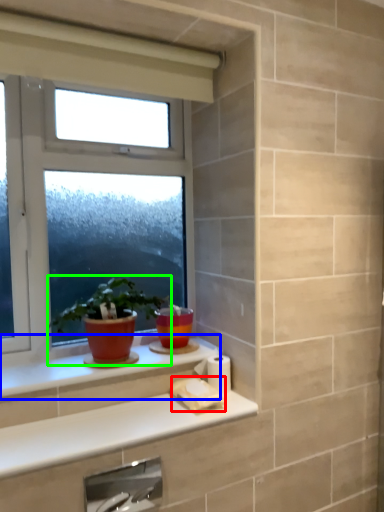
Question: Which object is the closest to the toilet paper (highlighted by a red box)? Choose among these: window sill (highlighted by a blue box) or houseplant (highlighted by a green box).

Choices:
 (A) window sill
 (B) houseplant

Answer: (A)